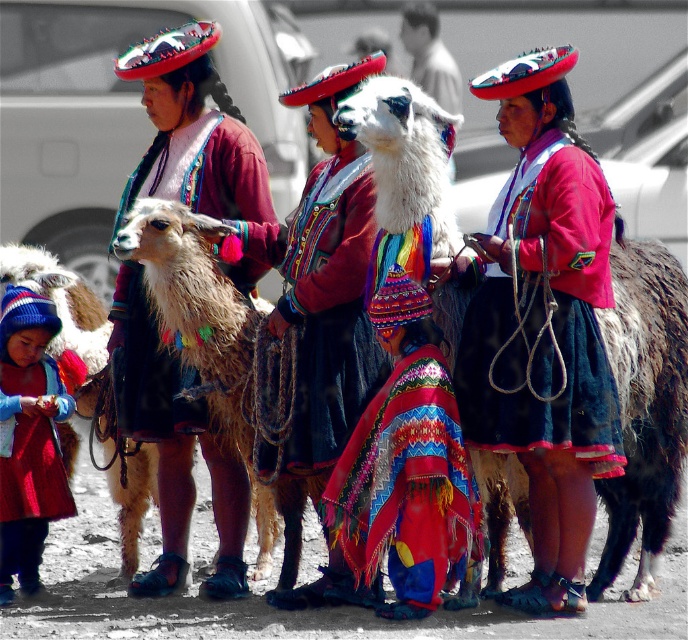
Question: Which of the following is the farthest from the observer?

Choices:
 (A) shiny red coat at lower left
 (B) white woolen llama at left

Answer: (B)

Question: Which point is farther from the camera taking this photo?

Choices:
 (A) (453, 480)
 (B) (182, 291)
 (C) (430, 80)

Answer: (C)

Question: Can you confirm if shiny red coat at lower left is wider than white woolen llama at left?

Choices:
 (A) yes
 (B) no

Answer: (A)

Question: Is fuzzy wool alpaca at center below white woolen llama at left?

Choices:
 (A) yes
 (B) no

Answer: (B)

Question: Among these objects, which one is farthest from the camera?

Choices:
 (A) multicolored woven fabric at center
 (B) matte black skirt at center
 (C) white woolen llama at left
 (D) shiny red coat at lower left

Answer: (C)

Question: Does multicolored woven fabric at center have a lesser width compared to white woolen llama at left?

Choices:
 (A) no
 (B) yes

Answer: (A)